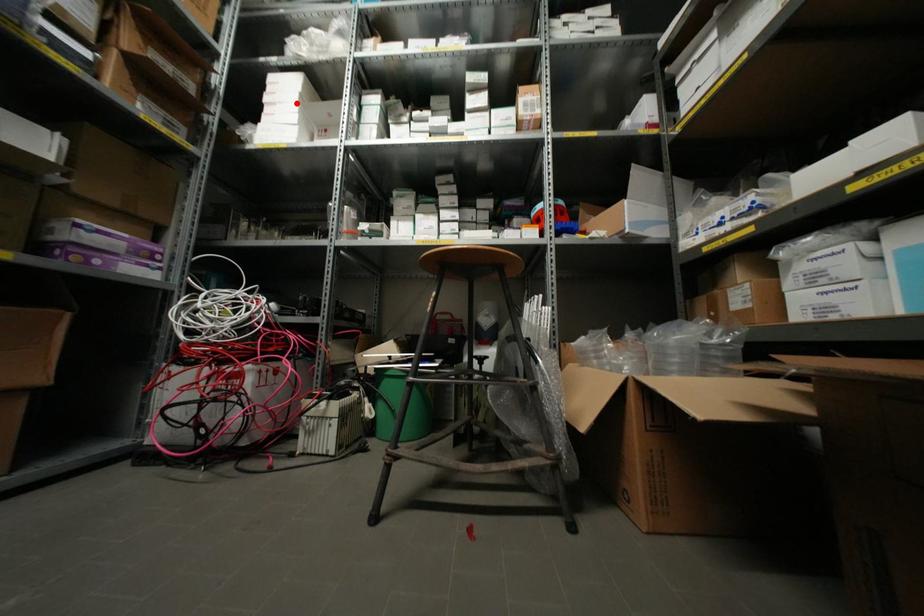
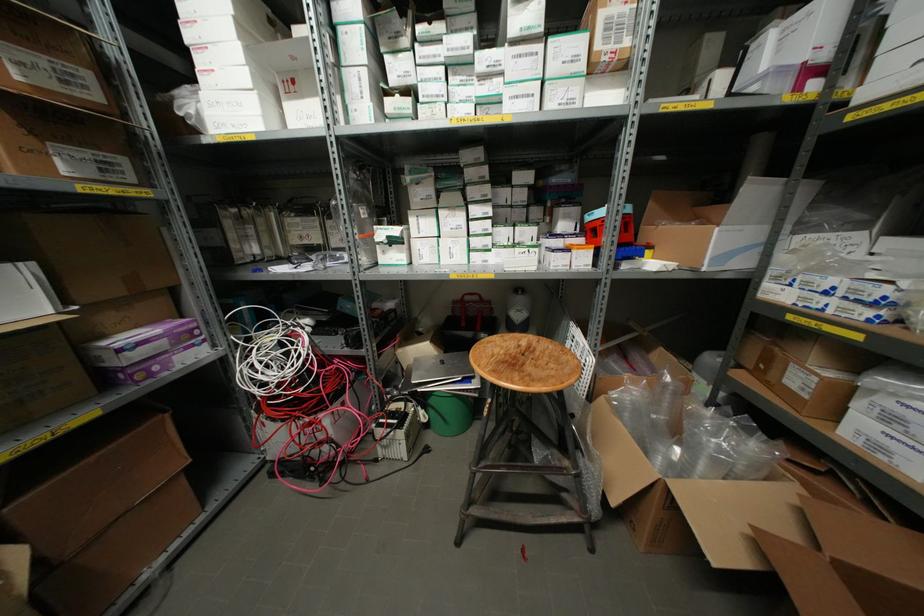
The point at the highlighted location is marked in the first image. Where is the corresponding point in the second image?

(237, 44)